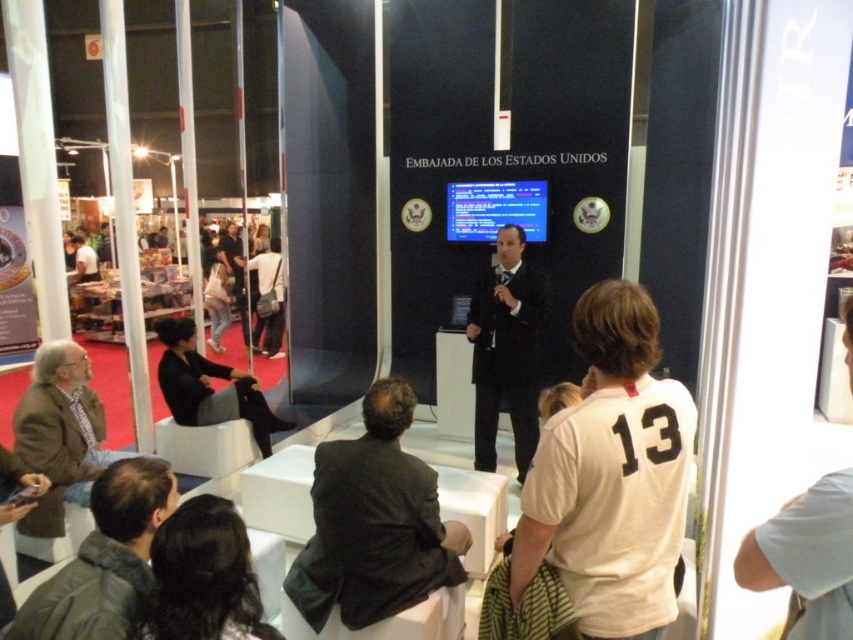
You are organizing a photo shoot in the event space and need to position a camera 5 meters away from the dark green jacket at lower left. Can the camera be placed near the dark gray fabric bag at center without exceeding the 5 meter distance?

The dark green jacket at lower left and dark gray fabric bag at center are 6.80 meters apart. Since the required distance for the camera is 5 meters, placing it near the dark gray fabric bag would exceed the 5 meter limit. Choose a closer spot instead.